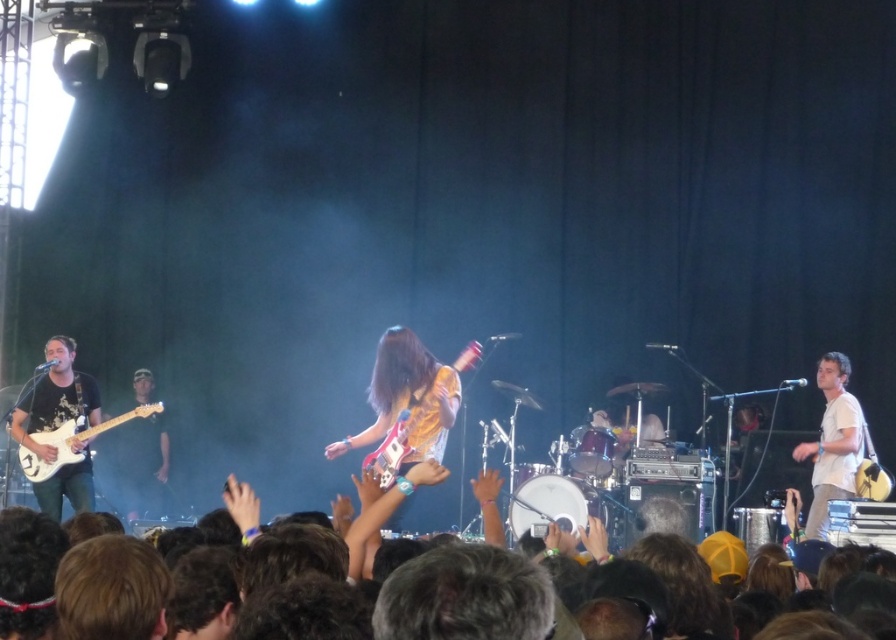
Is matte white guitar at left taller than white glossy electric guitar at left?

Correct, matte white guitar at left is much taller as white glossy electric guitar at left.

Is matte white guitar at left below white glossy electric guitar at left?

Actually, matte white guitar at left is above white glossy electric guitar at left.

Who is more distant from viewer, [85,388] or [66,444]?

The point [85,388] is more distant.

What are the coordinates of `matte white guitar at left` in the screenshot? It's located at (55, 397).

Does point (382, 355) come closer to viewer compared to point (50, 358)?

Yes, point (382, 355) is closer to viewer.

Does yellow fabric guitar at center appear on the left side of matte white guitar at left?

Incorrect, yellow fabric guitar at center is not on the left side of matte white guitar at left.

The image size is (896, 640). What do you see at coordinates (410, 397) in the screenshot?
I see `yellow fabric guitar at center` at bounding box center [410, 397].

You are a GUI agent. You are given a task and a screenshot of the screen. Output one action in this format:
    pyautogui.click(x=<x>, y=<y>)
    Task: Click on the yellow fabric guitar at center
    This screenshot has height=640, width=896.
    Given the screenshot: What is the action you would take?
    pyautogui.click(x=410, y=397)

Can you confirm if shiny metallic guitar at center is wider than matte black guitar at left?

Correct, the width of shiny metallic guitar at center exceeds that of matte black guitar at left.

Which of these two, shiny metallic guitar at center or matte black guitar at left, stands taller?

With more height is matte black guitar at left.

Who is more distant from viewer, (x=421, y=458) or (x=125, y=442)?

The point (x=125, y=442) is more distant.

Where is `shiny metallic guitar at center`? shiny metallic guitar at center is located at coordinates (411, 403).